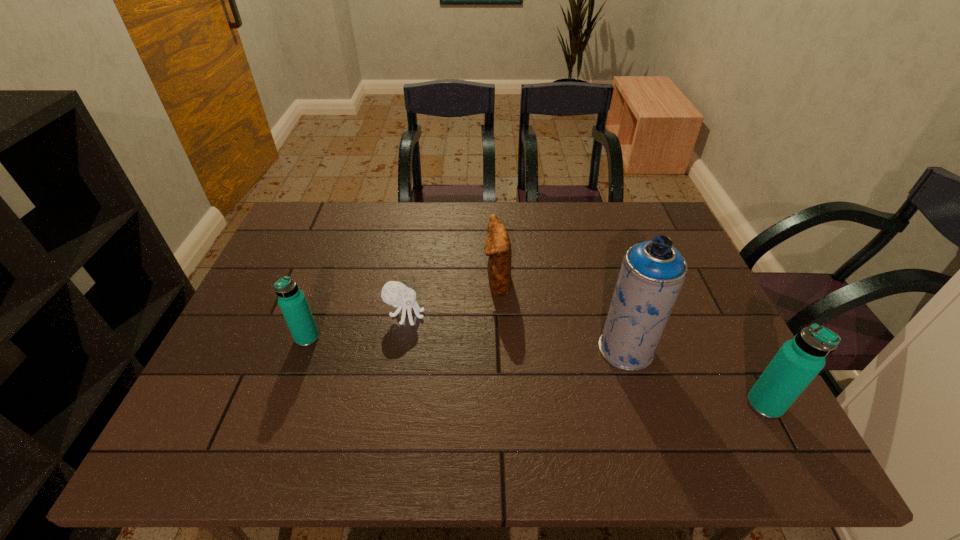
This screenshot has width=960, height=540. In order to click on the left water bottle in this screenshot , I will do `click(292, 301)`.

The width and height of the screenshot is (960, 540). I want to click on the farther water bottle, so click(292, 301).

Find the location of `the nearest object`. the nearest object is located at coordinates (798, 361).

You are a GUI agent. You are given a task and a screenshot of the screen. Output one action in this format:
    pyautogui.click(x=<x>, y=<y>)
    Task: Click on the taller water bottle
    
    Given the screenshot: What is the action you would take?
    pyautogui.click(x=798, y=361)

Image resolution: width=960 pixels, height=540 pixels. In order to click on clutch bag in this screenshot , I will do `click(497, 246)`.

Where is `the third object from left to right`? the third object from left to right is located at coordinates (497, 246).

Where is `aerosol can`? The height and width of the screenshot is (540, 960). aerosol can is located at coordinates (652, 273).

Where is `the fourth object from left to right`? The image size is (960, 540). the fourth object from left to right is located at coordinates (652, 273).

You are a GUI agent. You are given a task and a screenshot of the screen. Output one action in this format:
    pyautogui.click(x=<x>, y=<y>)
    Task: Click on the octopus
    The image size is (960, 540).
    Given the screenshot: What is the action you would take?
    pyautogui.click(x=394, y=293)

At what (x,y) coordinates should I click in order to perform the action: click on the fourth object from right to left. Please return your answer as a coordinate pair (x, y). This screenshot has height=540, width=960. Looking at the image, I should click on (394, 293).